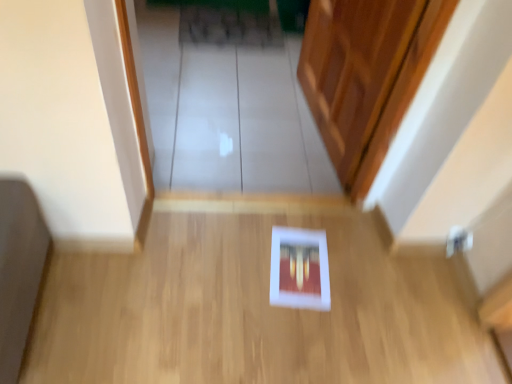
Question: Considering the positions of white matte book at center and transparent glass door at center in the image, is white matte book at center bigger or smaller than transparent glass door at center?

Choices:
 (A) small
 (B) big

Answer: (B)

Question: Is white matte book at center inside the boundaries of transparent glass door at center, or outside?

Choices:
 (A) outside
 (B) inside

Answer: (A)

Question: In terms of height, does white matte book at center look taller or shorter compared to transparent glass door at center?

Choices:
 (A) tall
 (B) short

Answer: (A)

Question: Do you think transparent glass door at center is within white matte book at center, or outside of it?

Choices:
 (A) outside
 (B) inside

Answer: (A)

Question: Considering the positions of transparent glass door at center and white matte book at center in the image, is transparent glass door at center bigger or smaller than white matte book at center?

Choices:
 (A) big
 (B) small

Answer: (B)

Question: Is point (203, 49) positioned closer to the camera than point (330, 264)?

Choices:
 (A) closer
 (B) farther

Answer: (B)

Question: In the image, is transparent glass door at center positioned in front of or behind white matte book at center?

Choices:
 (A) front
 (B) behind

Answer: (B)